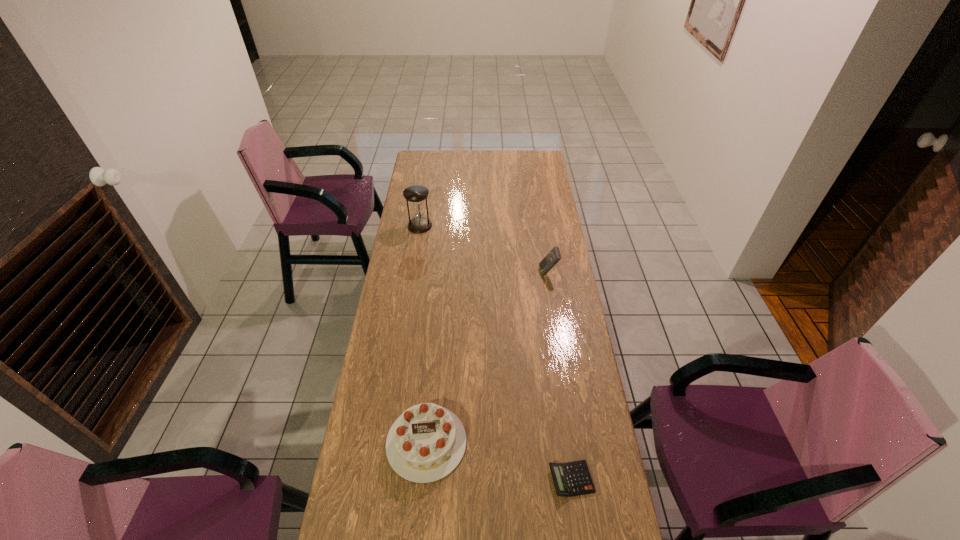
Locate an element on the screen. Image resolution: width=960 pixels, height=540 pixels. hourglass is located at coordinates (416, 194).

The height and width of the screenshot is (540, 960). I want to click on the farthest object, so click(416, 194).

Locate an element on the screen. The image size is (960, 540). the third shortest object is located at coordinates (551, 259).

This screenshot has width=960, height=540. Find the location of `the second farthest object`. the second farthest object is located at coordinates (551, 259).

This screenshot has width=960, height=540. Identify the location of birthday cake. (426, 443).

Image resolution: width=960 pixels, height=540 pixels. I want to click on the shorter calculator, so click(x=570, y=479).

Locate an element on the screen. Image resolution: width=960 pixels, height=540 pixels. the nearer calculator is located at coordinates (570, 479).

You are a GUI agent. You are given a task and a screenshot of the screen. Output one action in this format:
    pyautogui.click(x=<x>, y=<y>)
    Task: Click on the vacant space located 0.270m on the right of the tallest object
    The height and width of the screenshot is (540, 960).
    Given the screenshot: What is the action you would take?
    pyautogui.click(x=488, y=226)

Identify the location of vacant position located on the front-facing side of the farther calculator. Image resolution: width=960 pixels, height=540 pixels. (507, 272).

The width and height of the screenshot is (960, 540). I want to click on vacant space positioned on the front-facing side of the farther calculator, so click(493, 272).